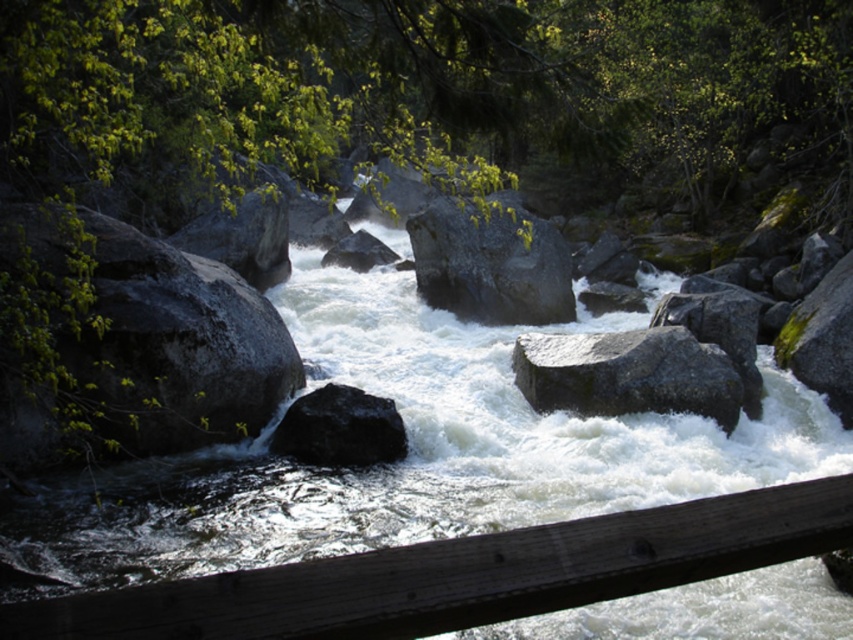
In the scene shown: Is wooden rail at lower center closer to the viewer compared to smooth gray rock at center?

Yes, wooden rail at lower center is in front of smooth gray rock at center.

Between wooden rail at lower center and smooth gray rock at center, which one appears on the left side from the viewer's perspective?

Positioned to the left is wooden rail at lower center.

Which is in front, point (460, 621) or point (428, 292)?

Point (460, 621) is more forward.

Image resolution: width=853 pixels, height=640 pixels. In order to click on wooden rail at lower center in this screenshot , I will do `click(463, 573)`.

Between wooden rail at lower center and green mossy rock at right, which one appears on the left side from the viewer's perspective?

wooden rail at lower center is more to the left.

Is point (212, 589) closer to camera compared to point (827, 376)?

Yes, point (212, 589) is closer to viewer.

Between point (361, 611) and point (815, 308), which one is positioned behind?

Point (815, 308)

At what (x,y) coordinates should I click in order to perform the action: click on wooden rail at lower center. Please return your answer as a coordinate pair (x, y). Looking at the image, I should click on (463, 573).

Can you confirm if dark gray rock at left is wider than smooth gray rock at center?

In fact, dark gray rock at left might be narrower than smooth gray rock at center.

Can you confirm if dark gray rock at left is taller than smooth gray rock at center?

In fact, dark gray rock at left may be shorter than smooth gray rock at center.

Identify the location of dark gray rock at left. This screenshot has width=853, height=640. (177, 346).